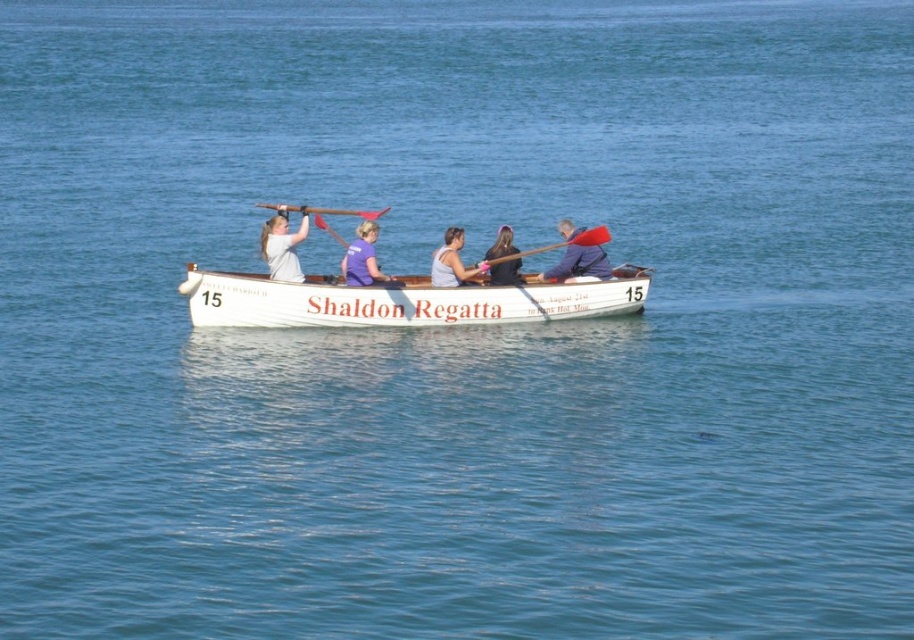
You are a photographer standing on the dock and want to take a photo of the white polished wood canoe at center and the white matte shirt at upper left. The minimum distance your camera can focus clearly is 1.5 meters. Will both subjects be in focus if they are at their current positions?

The white polished wood canoe at center is 1.89 meters from white matte shirt at upper left. Since the minimum focusing distance is 1.5 meters, the camera can focus clearly on both subjects as they are beyond the minimum required distance.

You are a photographer taking a photo of the rowing boat from the shore. You notice two points marked on your camera screen at coordinates point (290,268) and point (577,234). Which point is closer to your camera?

Point (290,268) is closer to the camera than point (577,234).

You are a spectator at the regatta event. You see the white polished wood canoe at center and the white matte shirt at upper left. Which object is closer to you?

The white polished wood canoe at center is closer to you because it is in front of the white matte shirt at upper left.